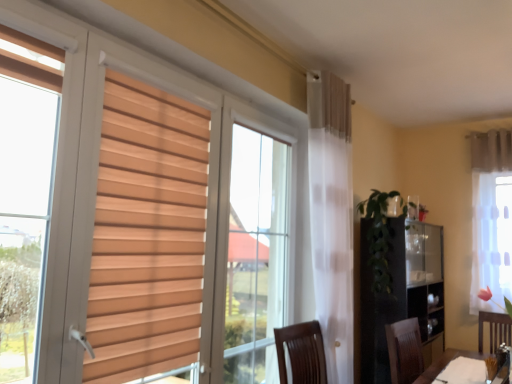
This screenshot has width=512, height=384. What do you see at coordinates (380, 238) in the screenshot?
I see `green leafy plant at center-right` at bounding box center [380, 238].

Image resolution: width=512 pixels, height=384 pixels. What are the coordinates of `white sheer curtain at upper right, the 2th curtain ordered from the bottom` in the screenshot? It's located at pyautogui.click(x=490, y=150).

Is white matte table at lower right thinner than green leafy plant at center-right?

Yes, white matte table at lower right is thinner than green leafy plant at center-right.

Can you confirm if white matte table at lower right is smaller than green leafy plant at center-right?

Indeed, white matte table at lower right has a smaller size compared to green leafy plant at center-right.

From the picture: Would you say white matte table at lower right is outside green leafy plant at center-right?

Yes.

Can you confirm if white matte table at lower right is positioned to the right of green leafy plant at center-right?

No.

Which of these two, white sheer curtain at upper right, positioned as the first curtain in top-to-bottom order, or white sheer curtain at right, marked as the second curtain in a top-to-bottom arrangement, stands taller?

With more height is white sheer curtain at right, marked as the second curtain in a top-to-bottom arrangement.

Are white sheer curtain at upper right, the 2th curtain ordered from the bottom, and white sheer curtain at right, marked as the second curtain in a top-to-bottom arrangement, far apart?

No, there isn't a large distance between white sheer curtain at upper right, the 2th curtain ordered from the bottom, and white sheer curtain at right, marked as the second curtain in a top-to-bottom arrangement.

Is white sheer curtain at upper right, the 2th curtain ordered from the bottom, to the left of white sheer curtain at right, acting as the 1th curtain starting from the bottom, from the viewer's perspective?

In fact, white sheer curtain at upper right, the 2th curtain ordered from the bottom, is to the right of white sheer curtain at right, acting as the 1th curtain starting from the bottom.

What's the angular difference between green leafy plant at center-right and white sheer curtain at upper right, the 2th curtain ordered from the bottom,'s facing directions?

They differ by 92.1 degrees in their facing directions.

Consider the image. Can we say green leafy plant at center-right lies outside white sheer curtain at upper right, the 2th curtain ordered from the bottom?

green leafy plant at center-right lies outside white sheer curtain at upper right, the 2th curtain ordered from the bottom,'s area.

Is green leafy plant at center-right placed right next to white sheer curtain at upper right, positioned as the first curtain in top-to-bottom order?

No, green leafy plant at center-right is not touching white sheer curtain at upper right, positioned as the first curtain in top-to-bottom order.

How distant is green leafy plant at center-right from white sheer curtain at upper right, positioned as the first curtain in top-to-bottom order?

green leafy plant at center-right and white sheer curtain at upper right, positioned as the first curtain in top-to-bottom order, are 1.40 meters apart.

From the image's perspective, between white sheer curtain at right, marked as the second curtain in a top-to-bottom arrangement, and white sheer curtain at upper right, the 2th curtain ordered from the bottom, who is located below?

white sheer curtain at right, marked as the second curtain in a top-to-bottom arrangement, appears lower in the image.

Is white sheer curtain at right, marked as the second curtain in a top-to-bottom arrangement, bigger or smaller than white sheer curtain at upper right, positioned as the first curtain in top-to-bottom order?

Considering their sizes, white sheer curtain at right, marked as the second curtain in a top-to-bottom arrangement, takes up more space than white sheer curtain at upper right, positioned as the first curtain in top-to-bottom order.

Who is shorter, white sheer curtain at right, acting as the 1th curtain starting from the bottom, or white sheer curtain at upper right, the 2th curtain ordered from the bottom?

white sheer curtain at upper right, the 2th curtain ordered from the bottom.

Is white sheer curtain at upper right, positioned as the first curtain in top-to-bottom order, located outside green leafy plant at center-right?

That's correct, white sheer curtain at upper right, positioned as the first curtain in top-to-bottom order, is outside of green leafy plant at center-right.

Identify the location of plant below the white sheer curtain at upper right, the 2th curtain ordered from the bottom (from the image's perspective). (380, 238).

Can you confirm if white sheer curtain at upper right, the 2th curtain ordered from the bottom, is positioned to the left of green leafy plant at center-right?

No, white sheer curtain at upper right, the 2th curtain ordered from the bottom, is not to the left of green leafy plant at center-right.

Can you see white sheer curtain at upper right, positioned as the first curtain in top-to-bottom order, touching green leafy plant at center-right?

No, white sheer curtain at upper right, positioned as the first curtain in top-to-bottom order, is not next to green leafy plant at center-right.

Are green leafy plant at center-right and white matte table at lower right far apart?

Yes.

In the image, is green leafy plant at center-right positioned in front of or behind white matte table at lower right?

green leafy plant at center-right is positioned farther from the viewer than white matte table at lower right.

Can you confirm if green leafy plant at center-right is thinner than white matte table at lower right?

No.

Is point (387, 222) positioned before point (440, 366)?

Yes, it is.

How many degrees apart are the facing directions of white matte table at lower right and white sheer curtain at right, marked as the second curtain in a top-to-bottom arrangement?

The facing directions of white matte table at lower right and white sheer curtain at right, marked as the second curtain in a top-to-bottom arrangement, are 83.6 degrees apart.

Which object is thinner, white matte table at lower right or white sheer curtain at right, acting as the 1th curtain starting from the bottom?

white sheer curtain at right, acting as the 1th curtain starting from the bottom, is thinner.

Is white matte table at lower right positioned in front of white sheer curtain at right, acting as the 1th curtain starting from the bottom?

Yes, white matte table at lower right is closer to the camera.

Is point (426, 370) positioned behind point (486, 283)?

No, it is not.

At what (x,y) coordinates should I click in order to perform the action: click on table below the green leafy plant at center-right (from a real-world perspective). Please return your answer as a coordinate pair (x, y). The image size is (512, 384). Looking at the image, I should click on (446, 364).

At what (x,y) coordinates should I click in order to perform the action: click on curtain lying above the white sheer curtain at right, marked as the second curtain in a top-to-bottom arrangement (from the image's perspective). Please return your answer as a coordinate pair (x, y). This screenshot has height=384, width=512. Looking at the image, I should click on (490, 150).

Considering their positions, is white sheer curtain at right, acting as the 1th curtain starting from the bottom, positioned closer to white sheer curtain at upper right, the 2th curtain ordered from the bottom, than green leafy plant at center-right?

Among the two, white sheer curtain at right, acting as the 1th curtain starting from the bottom, is located nearer to white sheer curtain at upper right, the 2th curtain ordered from the bottom.

Considering their positions, is green leafy plant at center-right positioned further to white sheer curtain at right, marked as the second curtain in a top-to-bottom arrangement, than white matte table at lower right?

green leafy plant at center-right.

Based on their spatial positions, is green leafy plant at center-right or white matte table at lower right closer to white sheer curtain at upper right, the 2th curtain ordered from the bottom?

green leafy plant at center-right is positioned closer to the anchor white sheer curtain at upper right, the 2th curtain ordered from the bottom.

From the image, which object appears to be nearer to white sheer curtain at right, marked as the second curtain in a top-to-bottom arrangement, white sheer curtain at upper right, the 2th curtain ordered from the bottom, or green leafy plant at center-right?

Among the two, white sheer curtain at upper right, the 2th curtain ordered from the bottom, is located nearer to white sheer curtain at right, marked as the second curtain in a top-to-bottom arrangement.

When comparing their distances from green leafy plant at center-right, does white sheer curtain at upper right, the 2th curtain ordered from the bottom, or white matte table at lower right seem closer?

Based on the image, white matte table at lower right appears to be nearer to green leafy plant at center-right.

Based on their spatial positions, is white matte table at lower right or white sheer curtain at upper right, positioned as the first curtain in top-to-bottom order, closer to white sheer curtain at right, acting as the 1th curtain starting from the bottom?

white sheer curtain at upper right, positioned as the first curtain in top-to-bottom order, lies closer to white sheer curtain at right, acting as the 1th curtain starting from the bottom, than the other object.

From the image, which object appears to be farther from white sheer curtain at upper right, positioned as the first curtain in top-to-bottom order, green leafy plant at center-right or white sheer curtain at right, marked as the second curtain in a top-to-bottom arrangement?

green leafy plant at center-right is further to white sheer curtain at upper right, positioned as the first curtain in top-to-bottom order.

Which object lies further to the anchor point white sheer curtain at upper right, positioned as the first curtain in top-to-bottom order, white sheer curtain at right, acting as the 1th curtain starting from the bottom, or white matte table at lower right?

Among the two, white matte table at lower right is located further to white sheer curtain at upper right, positioned as the first curtain in top-to-bottom order.

At what (x,y) coordinates should I click in order to perform the action: click on curtain between white matte table at lower right and white sheer curtain at upper right, the 2th curtain ordered from the bottom, from front to back. Please return your answer as a coordinate pair (x, y). Looking at the image, I should click on (490, 218).

Identify the location of curtain between green leafy plant at center-right and white sheer curtain at upper right, positioned as the first curtain in top-to-bottom order. (490, 218).

You are a GUI agent. You are given a task and a screenshot of the screen. Output one action in this format:
    pyautogui.click(x=<x>, y=<y>)
    Task: Click on the plant between white matte table at lower right and white sheer curtain at upper right, the 2th curtain ordered from the bottom, in the front-back direction
    
    Given the screenshot: What is the action you would take?
    pyautogui.click(x=380, y=238)

Where is `plant between white matte table at lower right and white sheer curtain at right, acting as the 1th curtain starting from the bottom, along the z-axis`? The image size is (512, 384). plant between white matte table at lower right and white sheer curtain at right, acting as the 1th curtain starting from the bottom, along the z-axis is located at coordinates (380, 238).